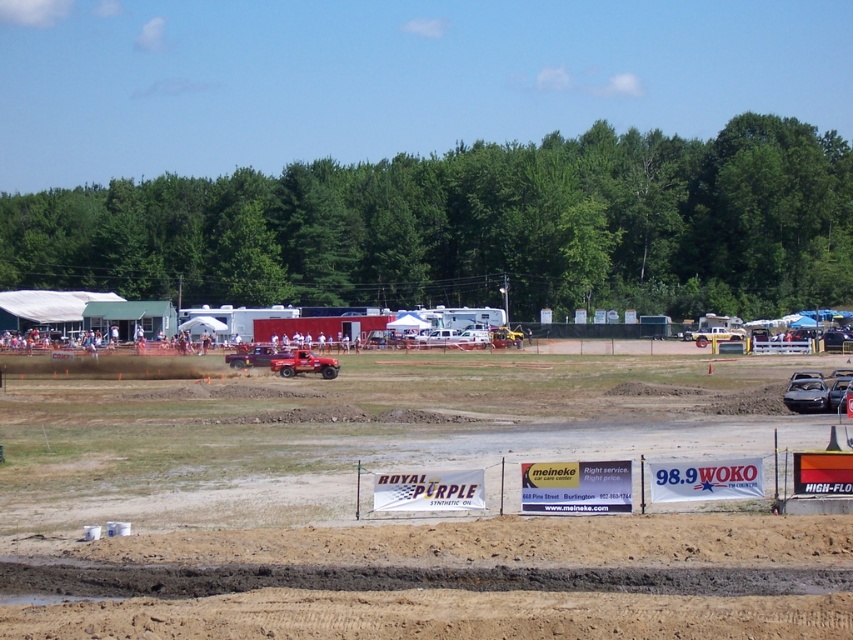
Measure the distance between shiny red truck at center and camera.

A distance of 84.96 meters exists between shiny red truck at center and camera.

Is shiny red truck at center smaller than matte red truck at center?

Yes, shiny red truck at center is smaller than matte red truck at center.

Which is in front, point (320, 371) or point (256, 364)?

Point (320, 371) is in front.

You are a GUI agent. You are given a task and a screenshot of the screen. Output one action in this format:
    pyautogui.click(x=<x>, y=<y>)
    Task: Click on the shiny red truck at center
    
    Given the screenshot: What is the action you would take?
    pyautogui.click(x=305, y=364)